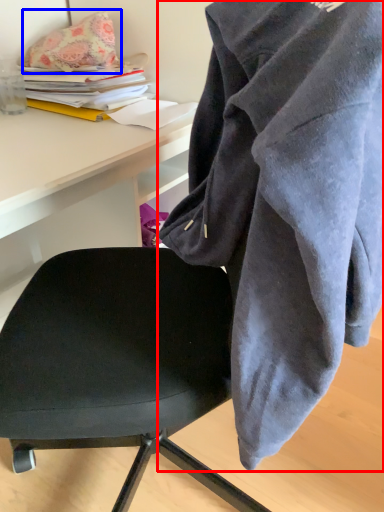
Question: Which object is further to the camera taking this photo, cloak (highlighted by a red box) or pillow (highlighted by a blue box)?

Choices:
 (A) cloak
 (B) pillow

Answer: (B)